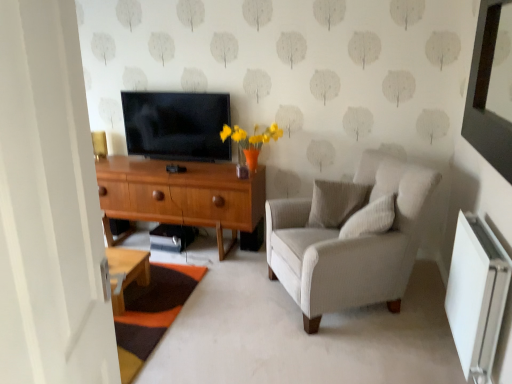
The width and height of the screenshot is (512, 384). In order to click on vacant space underneath matte black tv at center (from a real-world perspective) in this screenshot , I will do `click(182, 157)`.